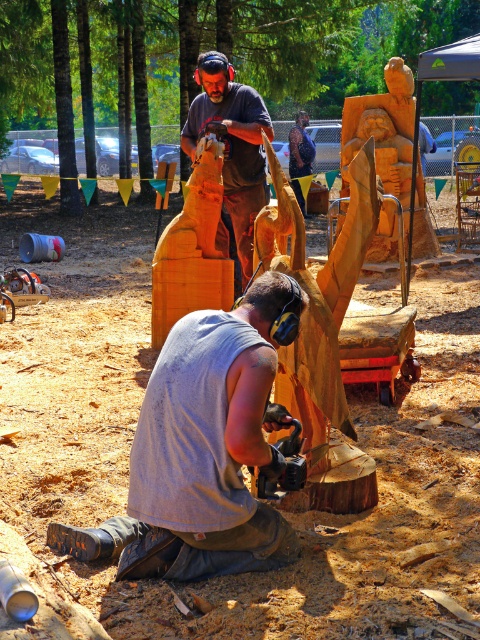
Can you confirm if gray fabric squat at lower center is smaller than matte brown wood carving at upper center?

Yes, gray fabric squat at lower center is smaller than matte brown wood carving at upper center.

Describe the element at coordinates (205, 449) in the screenshot. I see `gray fabric squat at lower center` at that location.

Find the location of a particular element. The image size is (480, 640). gray fabric squat at lower center is located at coordinates (205, 449).

You are a GUI agent. You are given a task and a screenshot of the screen. Output one action in this format:
    pyautogui.click(x=<x>, y=<y>)
    Task: Click on the gray fabric squat at lower center
    This screenshot has height=640, width=480.
    Given the screenshot: What is the action you would take?
    pyautogui.click(x=205, y=449)